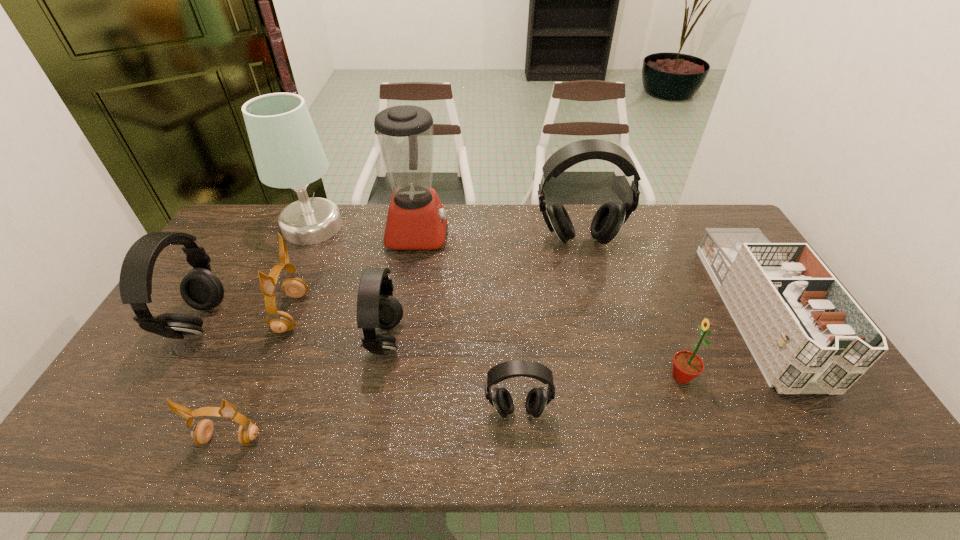
At what (x,y) coordinates should I click in order to perform the action: click on the rightmost object. Please return your answer as a coordinate pair (x, y). The width and height of the screenshot is (960, 540). Looking at the image, I should click on (806, 333).

Identify the location of the second nearest earphone. Image resolution: width=960 pixels, height=540 pixels. (537, 399).

Locate an element on the screen. The width and height of the screenshot is (960, 540). the nearest black earphone is located at coordinates (537, 399).

The width and height of the screenshot is (960, 540). I want to click on the nearest object, so click(201, 432).

The width and height of the screenshot is (960, 540). I want to click on the smaller brown earphone, so click(x=201, y=432).

At what (x,y) coordinates should I click in order to perform the action: click on vacant space located on the front of the blender near the controls. Please return your answer as a coordinate pair (x, y). Image resolution: width=960 pixels, height=540 pixels. Looking at the image, I should click on (549, 233).

Where is `blank space located 0.060m on the base of the gray lampshade`? Image resolution: width=960 pixels, height=540 pixels. blank space located 0.060m on the base of the gray lampshade is located at coordinates (359, 227).

I want to click on vacant space located 0.260m on the ear cups of the biggest black earphone, so click(597, 311).

Locate an element on the screen. vacant area located 0.120m on the ear cups of the leftmost earphone is located at coordinates (262, 323).

Where is `free point located on the front-facing side of the farther brown earphone`? free point located on the front-facing side of the farther brown earphone is located at coordinates (387, 313).